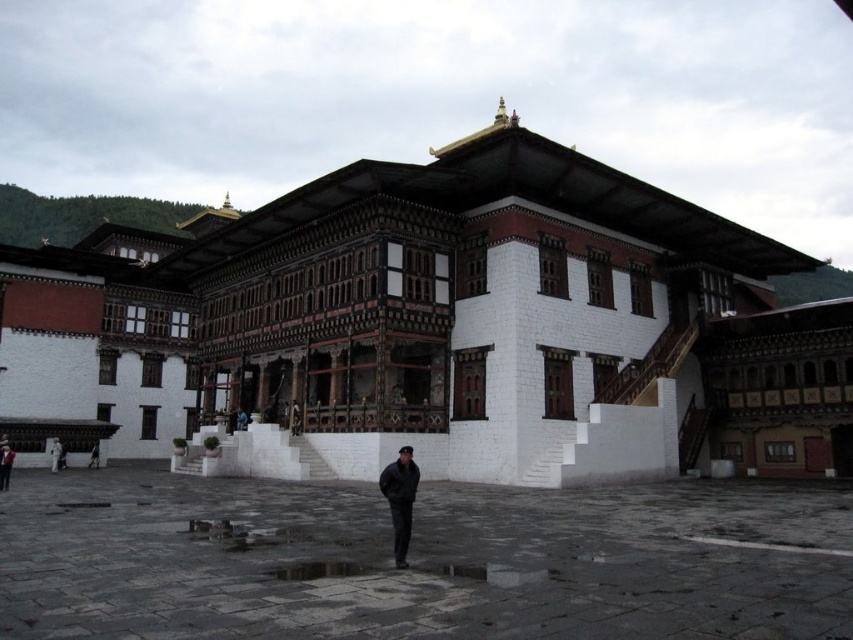
Which of these two, white painted wood monastery at center or gray stone courtyard at center, stands shorter?

gray stone courtyard at center

Does white painted wood monastery at center have a lesser width compared to gray stone courtyard at center?

Incorrect, white painted wood monastery at center's width is not less than gray stone courtyard at center's.

Is point (91, 420) closer to camera compared to point (677, 566)?

No.

Identify the location of white painted wood monastery at center. The width and height of the screenshot is (853, 640). (432, 330).

Can you confirm if dark gray fabric jacket at lower left is taller than dark gray fabric at lower left?

Yes.

From the picture: Which of these two, dark gray fabric jacket at lower left or dark gray fabric at lower left, stands taller?

With more height is dark gray fabric jacket at lower left.

Find the location of `dark gray fabric jacket at lower left`. dark gray fabric jacket at lower left is located at coordinates (4, 465).

Locate an element on the screen. Image resolution: width=853 pixels, height=640 pixels. dark gray fabric jacket at lower left is located at coordinates (4, 465).

Does white painted wood monastery at center have a smaller size compared to dark gray fabric at lower left?

Incorrect, white painted wood monastery at center is not smaller in size than dark gray fabric at lower left.

Between white painted wood monastery at center and dark gray fabric at lower left, which one has more height?

With more height is white painted wood monastery at center.

Locate an element on the screen. The width and height of the screenshot is (853, 640). white painted wood monastery at center is located at coordinates (432, 330).